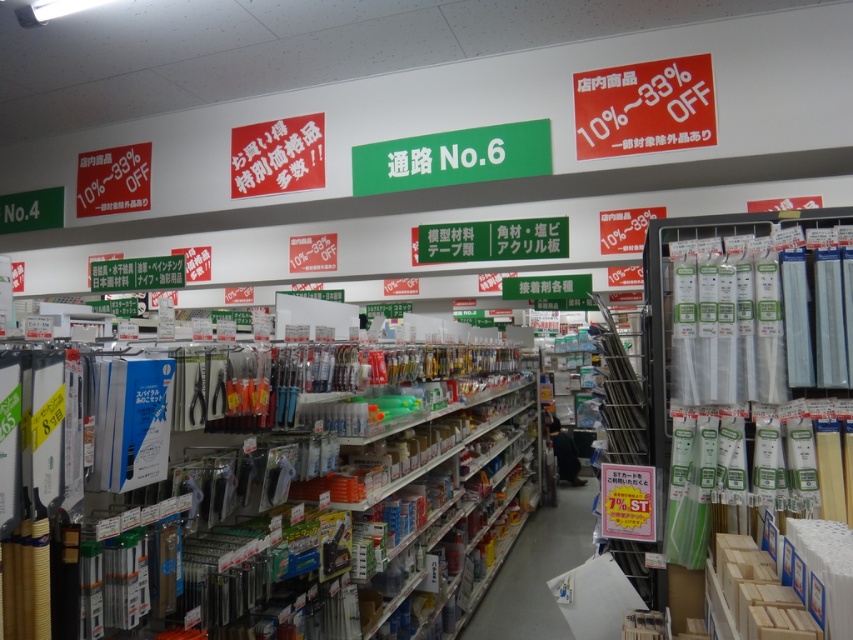
You are a customer in the store looking at the clear plastic tubes at right and the white paper sign at upper right. Which object is closer to you?

The clear plastic tubes at right is in front of the white paper sign at upper right, so it is closer to you.

You are a customer in the store and want to find the clear plastic tubes at right. Based on the store layout, where should you look in the aisle?

The clear plastic tubes at right are located at point (x=752, y=396) in the aisle.

From the picture: You are standing in Aisle 6 of the store and want to reach a point that is 5.58 feet away from you. Can you confirm if the point at coordinates (712, 240) is exactly 5.58 feet away from your current position?

Yes, the point at coordinates (712, 240) is exactly 5.58 feet away from your current position according to the provided information.